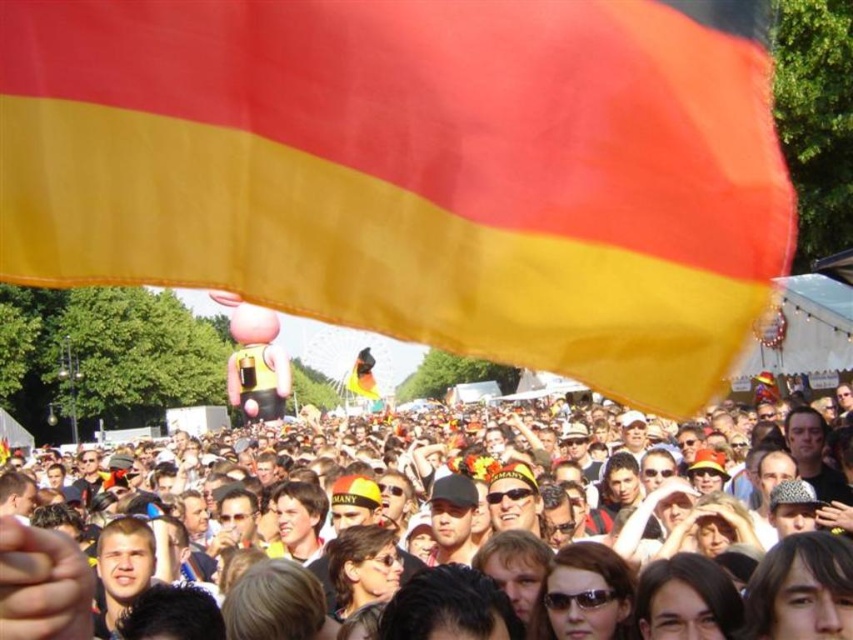
Question: Among these objects, which one is nearest to the camera?

Choices:
 (A) matte yellow flag at upper center
 (B) matte fabric flag at upper center

Answer: (A)

Question: Does matte fabric flag at upper center appear on the left side of matte yellow flag at upper center?

Choices:
 (A) yes
 (B) no

Answer: (B)

Question: Which object is closer to the camera taking this photo?

Choices:
 (A) matte fabric flag at upper center
 (B) matte yellow flag at upper center

Answer: (B)

Question: Can you confirm if matte fabric flag at upper center is positioned to the right of matte yellow flag at upper center?

Choices:
 (A) no
 (B) yes

Answer: (B)

Question: Which point is closer to the camera?

Choices:
 (A) matte fabric flag at upper center
 (B) matte yellow flag at upper center

Answer: (B)

Question: Does matte fabric flag at upper center appear on the left side of matte yellow flag at upper center?

Choices:
 (A) yes
 (B) no

Answer: (B)